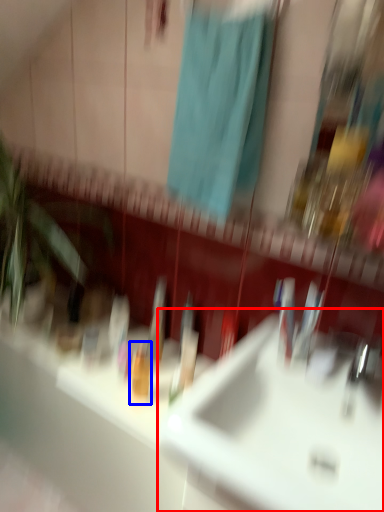
Question: Which of the following is the closest to the observer, sink (highlighted by a red box) or toiletry (highlighted by a blue box)?

Choices:
 (A) sink
 (B) toiletry

Answer: (A)